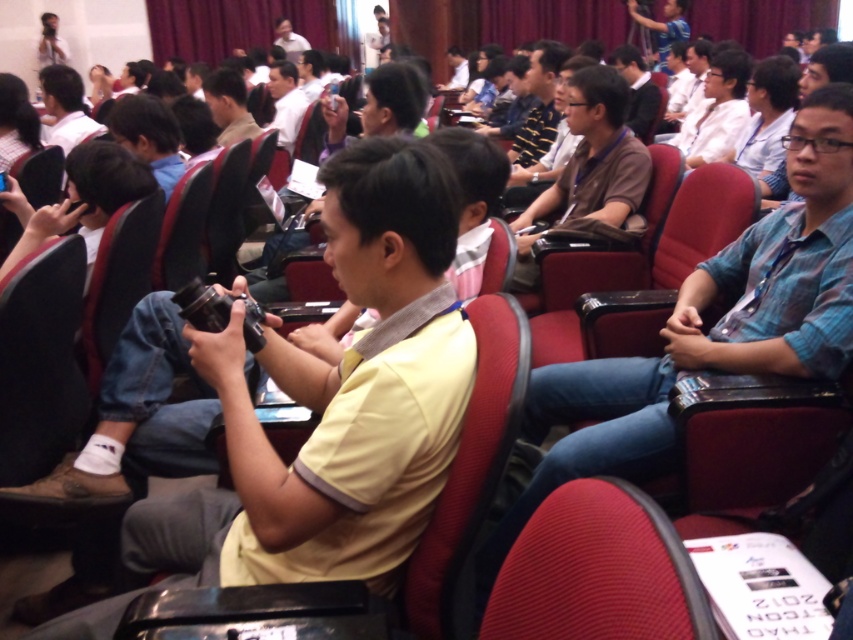
Question: Which object is positioned farthest from the blue plaid shirt at right?

Choices:
 (A) blue fabric shirt at upper right
 (B) matte black camera at upper left
 (C) matte brown shirt at upper center

Answer: (A)

Question: Among these points, which one is nearest to the camera?

Choices:
 (A) (451, 548)
 (B) (288, 128)

Answer: (A)

Question: From the image, what is the correct spatial relationship of red fabric chair at lower center in relation to matte black camera at upper left?

Choices:
 (A) right
 (B) left

Answer: (A)

Question: Can you confirm if dark blue shirt at center is positioned above white shirt at upper center?

Choices:
 (A) no
 (B) yes

Answer: (A)

Question: Which object is positioned closest to the white shirt at upper center?

Choices:
 (A) matte brown shirt at upper center
 (B) matte black camera at upper left
 (C) yellow matte shirt at center
 (D) brown fabric shirt at center

Answer: (A)

Question: Does red fabric chair at lower center appear over white shirt at upper center?

Choices:
 (A) yes
 (B) no

Answer: (B)